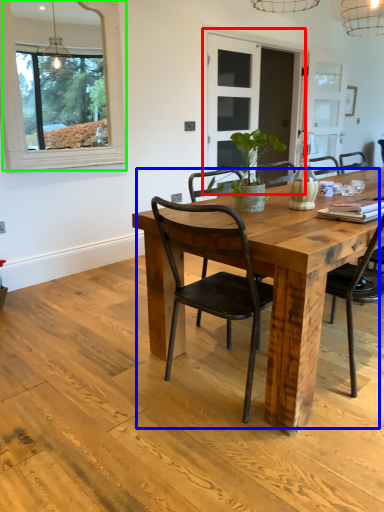
Question: Which object is the closest to the glass door (highlighted by a red box)? Choose among these: kitchen & dining room table (highlighted by a blue box) or window (highlighted by a green box).

Choices:
 (A) kitchen & dining room table
 (B) window

Answer: (B)